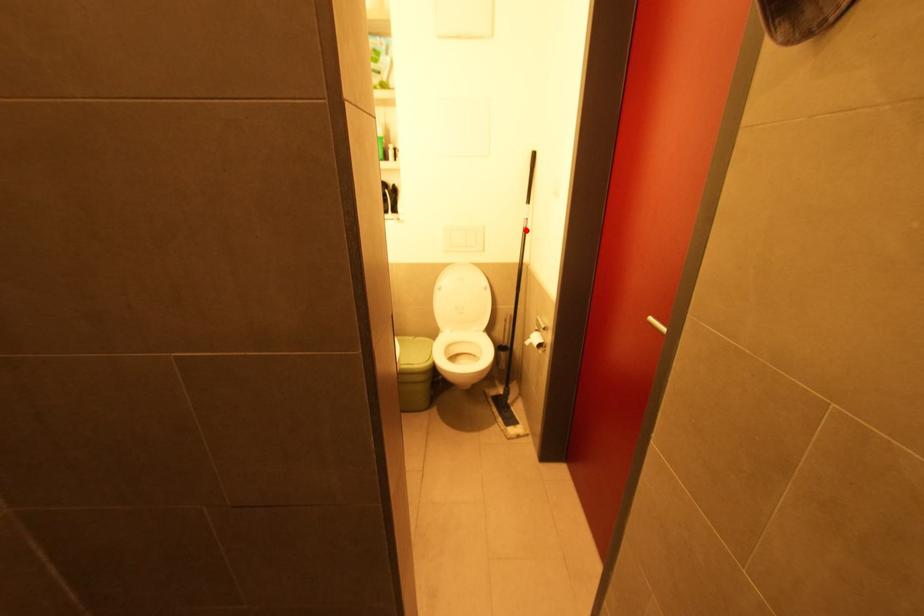
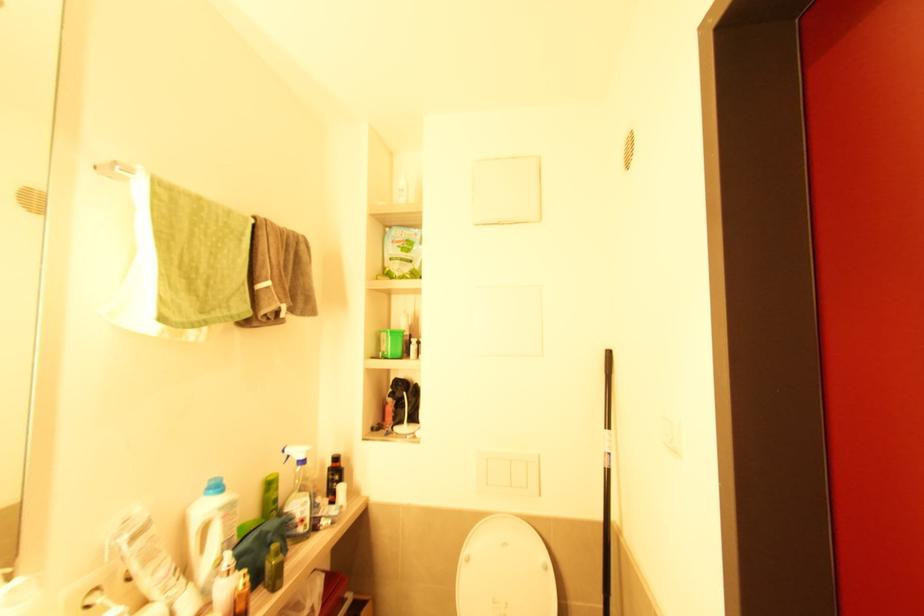
Question: A red point is marked in image1. In image2, is the corresponding 3D point closer to the camera or farther? Reply with the corresponding letter.

Choices:
 (A) The corresponding 3D point is closer.
 (B) The corresponding 3D point is farther.

Answer: (B)